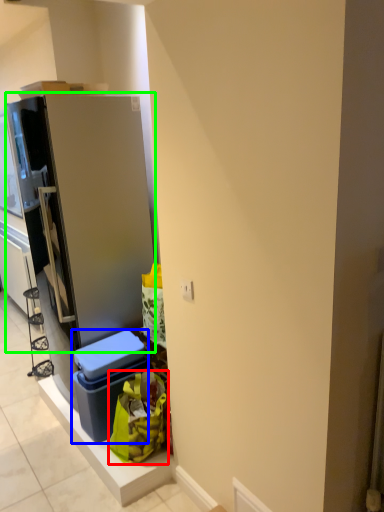
Question: Based on their relative distances, which object is nearer to garbage (highlighted by a red box)? Choose from storage box (highlighted by a blue box) and refrigerator (highlighted by a green box).

Choices:
 (A) storage box
 (B) refrigerator

Answer: (A)